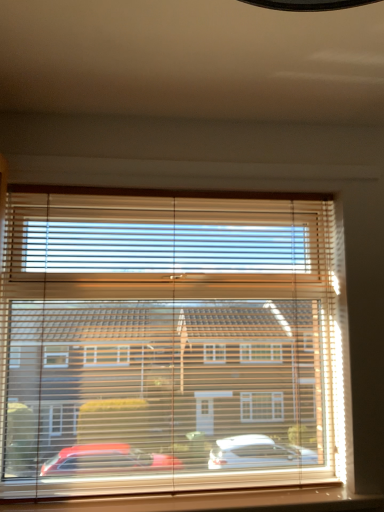
The height and width of the screenshot is (512, 384). In order to click on wooden blinds at center in this screenshot , I will do `click(165, 342)`.

In order to face wooden blinds at center, should I rotate leftwards or rightwards?

A 2.393 degree turn to the left will do.

What do you see at coordinates (165, 342) in the screenshot? This screenshot has width=384, height=512. I see `wooden blinds at center` at bounding box center [165, 342].

What do you see at coordinates (215, 501) in the screenshot? The width and height of the screenshot is (384, 512). I see `wooden at lower center` at bounding box center [215, 501].

Where is `wooden at lower center`? The width and height of the screenshot is (384, 512). wooden at lower center is located at coordinates (215, 501).

The image size is (384, 512). In order to click on wooden blinds at center in this screenshot , I will do `click(165, 342)`.

Can you confirm if wooden blinds at center is positioned to the right of wooden at lower center?

No.

Based on the photo, considering the positions of objects wooden blinds at center and wooden at lower center in the image provided, who is in front, wooden blinds at center or wooden at lower center?

wooden at lower center.

Is point (42, 368) more distant than point (374, 502)?

Yes, point (42, 368) is behind point (374, 502).

From the image's perspective, relative to wooden at lower center, is wooden blinds at center above or below?

From the image's perspective, wooden blinds at center appears above wooden at lower center.

From a real-world perspective, is wooden blinds at center above or below wooden at lower center?

Clearly, from a real-world perspective, wooden blinds at center is above wooden at lower center.

Considering the sizes of wooden blinds at center and wooden at lower center in the image, is wooden blinds at center wider or thinner than wooden at lower center?

Considering their sizes, wooden blinds at center looks slimmer than wooden at lower center.

Can you confirm if wooden blinds at center is taller than wooden at lower center?

Indeed, wooden blinds at center has a greater height compared to wooden at lower center.

Which of these two, wooden blinds at center or wooden at lower center, is smaller?

With smaller size is wooden at lower center.

Is wooden blinds at center not within wooden at lower center?

Yes, wooden blinds at center is located beyond the bounds of wooden at lower center.

Is wooden blinds at center next to wooden at lower center?

wooden blinds at center and wooden at lower center are not in contact.

Could you tell me if wooden blinds at center is facing wooden at lower center?

Yes, wooden blinds at center faces towards wooden at lower center.

Where is `window sill on the right of wooden blinds at center`? This screenshot has height=512, width=384. window sill on the right of wooden blinds at center is located at coordinates (215, 501).

Which object is positioned more to the left, wooden at lower center or wooden blinds at center?

wooden blinds at center.

Considering the positions of objects wooden at lower center and wooden blinds at center in the image provided, who is behind, wooden at lower center or wooden blinds at center?

wooden blinds at center is further away from the camera.

Which is farther, (218, 498) or (291, 373)?

Positioned behind is point (291, 373).

From the image's perspective, would you say wooden at lower center is positioned over wooden blinds at center?

No, from the image's perspective, wooden at lower center is not on top of wooden blinds at center.

From a real-world perspective, is wooden at lower center located higher than wooden blinds at center?

No, from a real-world perspective, wooden at lower center is not over wooden blinds at center

Considering the relative sizes of wooden at lower center and wooden blinds at center in the image provided, is wooden at lower center wider than wooden blinds at center?

Indeed, wooden at lower center has a greater width compared to wooden blinds at center.

Who is shorter, wooden at lower center or wooden blinds at center?

With less height is wooden at lower center.

Considering the relative sizes of wooden at lower center and wooden blinds at center in the image provided, is wooden at lower center bigger than wooden blinds at center?

Incorrect, wooden at lower center is not larger than wooden blinds at center.

Is wooden blinds at center completely or partially inside wooden at lower center?

Actually, wooden blinds at center is outside wooden at lower center.

Are wooden at lower center and wooden blinds at center beside each other?

There is a gap between wooden at lower center and wooden blinds at center.

In the scene shown: Is wooden at lower center looking in the opposite direction of wooden blinds at center?

Yes, wooden at lower center is positioned with its back facing wooden blinds at center.

What's the angular difference between wooden at lower center and wooden blinds at center's facing directions?

The facing directions of wooden at lower center and wooden blinds at center are 0.00059 degrees apart.

How distant is wooden at lower center from wooden blinds at center?

The distance of wooden at lower center from wooden blinds at center is 17.95 inches.

Find the location of `bay window above the wooden at lower center (from the image's perspective)`. bay window above the wooden at lower center (from the image's perspective) is located at coordinates (165, 342).

Identify the location of window sill located in front of the wooden blinds at center. This screenshot has height=512, width=384. (215, 501).

The width and height of the screenshot is (384, 512). What are the coordinates of `window sill lying below the wooden blinds at center (from the image's perspective)` in the screenshot? It's located at (215, 501).